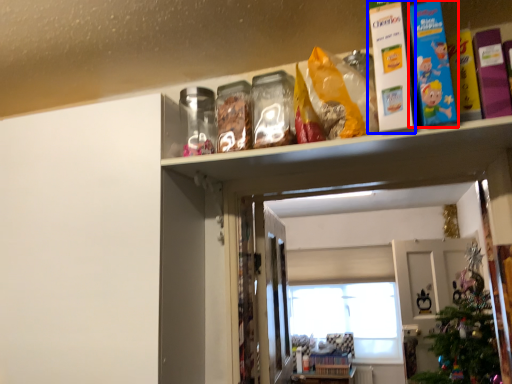
Question: Which point is further to the camera, book (highlighted by a red box) or book (highlighted by a blue box)?

Choices:
 (A) book
 (B) book

Answer: (B)